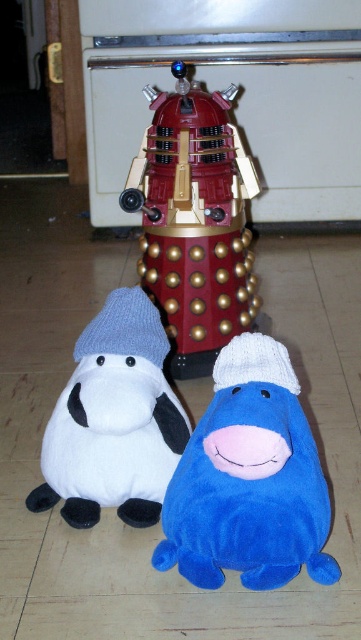
Question: Estimate the real-world distances between objects in this image. Which object is closer to the metallic gold dalek at center?

Choices:
 (A) velvety blue plush at lower center
 (B) gray knitted hat at center

Answer: (B)

Question: Among these points, which one is nearest to the camera?

Choices:
 (A) (220, 211)
 (B) (101, 435)
 (C) (261, 556)
 (D) (110, 301)

Answer: (C)

Question: Does metallic gold dalek at center appear on the right side of gray knitted hat at center?

Choices:
 (A) no
 (B) yes

Answer: (B)

Question: Which point is farther from the camera taking this photo?

Choices:
 (A) (149, 285)
 (B) (293, 572)
 (C) (158, 360)
 (D) (99, 332)

Answer: (A)

Question: Is velvety blue plush at lower center further to camera compared to metallic gold dalek at center?

Choices:
 (A) no
 (B) yes

Answer: (A)

Question: Is metallic gold dalek at center to the left of gray knitted hat at center from the viewer's perspective?

Choices:
 (A) yes
 (B) no

Answer: (B)